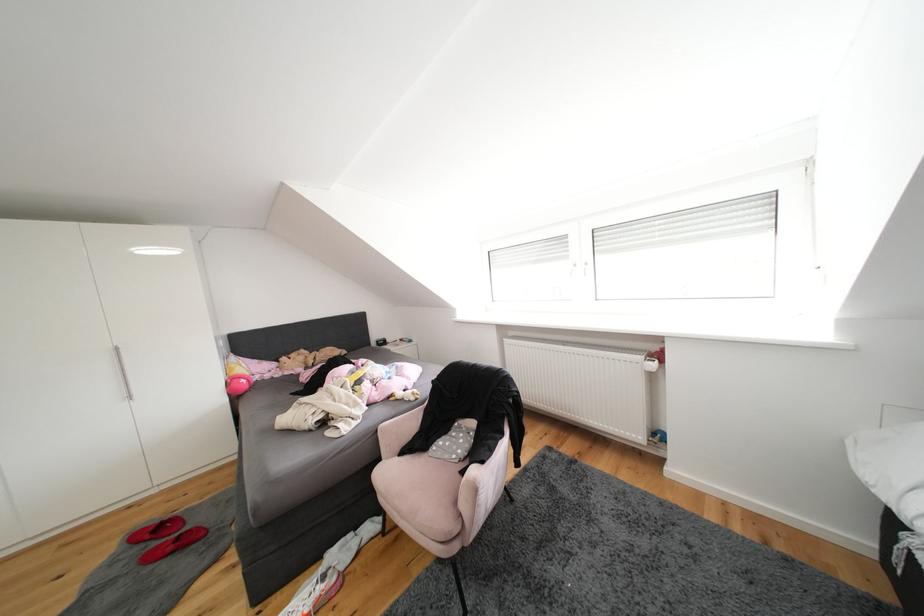
What do you see at coordinates (123, 373) in the screenshot?
I see `the white wardrobe handle` at bounding box center [123, 373].